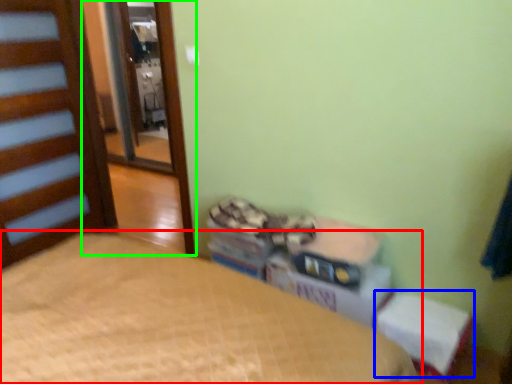
Question: Which object is positioned closest to bed (highlighted by a red box)? Select from changing table (highlighted by a blue box) and screen door (highlighted by a green box).

Choices:
 (A) changing table
 (B) screen door

Answer: (A)